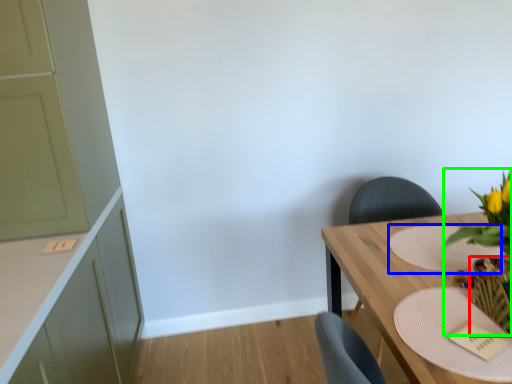
Question: Estimate the real-world distances between objects in this image. Which object is closer to vase (highlighted by a red box), plate (highlighted by a blue box) or floral arrangement (highlighted by a green box)?

Choices:
 (A) plate
 (B) floral arrangement

Answer: (B)